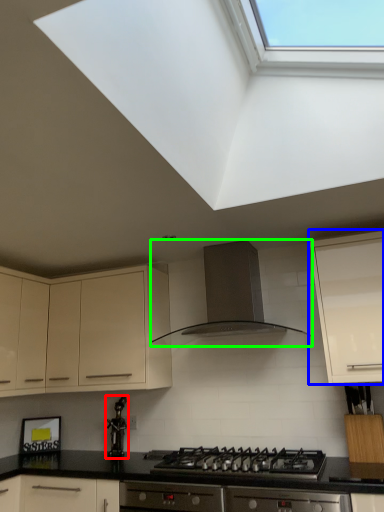
Question: Which is nearer to the appliance (highlighted by a red box)? cabinetry (highlighted by a blue box) or kitchen appliance (highlighted by a green box).

Choices:
 (A) cabinetry
 (B) kitchen appliance

Answer: (B)